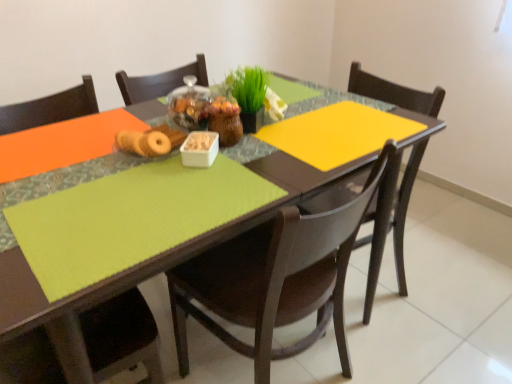
Where is `vacant space positioned to the left of white plastic container at center`? This screenshot has width=512, height=384. vacant space positioned to the left of white plastic container at center is located at coordinates (122, 175).